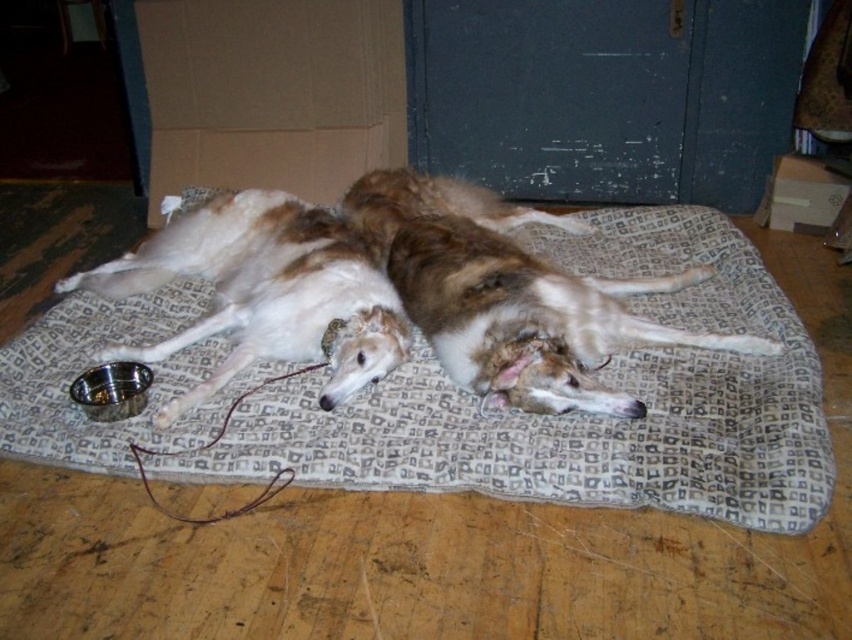
Between patterned fabric dog bed at center and brown fur dog at center, which one is positioned higher?

brown fur dog at center is above.

Measure the distance between point [810,448] and camera.

A distance of 6.18 feet exists between point [810,448] and camera.

Which is in front, point (33, 449) or point (485, 374)?

Point (33, 449) is in front.

Identify the location of patterned fabric dog bed at center. This screenshot has height=640, width=852. (x=583, y=413).

Between patterned fabric dog bed at center and white fur dog at center, which one has more height?

patterned fabric dog bed at center

How much distance is there between patterned fabric dog bed at center and white fur dog at center?

A distance of 12.61 inches exists between patterned fabric dog bed at center and white fur dog at center.

Is point (59, 314) closer to camera compared to point (265, 259)?

No, (59, 314) is behind (265, 259).

In order to click on patterned fabric dog bed at center in this screenshot , I will do `click(583, 413)`.

Who is lower down, white fur dog at center or brown fur dog at center?

brown fur dog at center

Locate an element on the screen. The width and height of the screenshot is (852, 640). white fur dog at center is located at coordinates (265, 292).

At what (x,y) coordinates should I click in order to perform the action: click on white fur dog at center. Please return your answer as a coordinate pair (x, y). The image size is (852, 640). Looking at the image, I should click on [x=265, y=292].